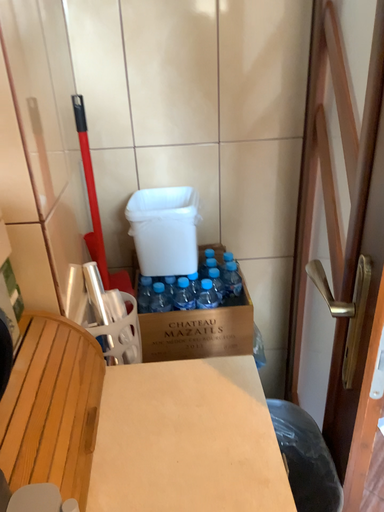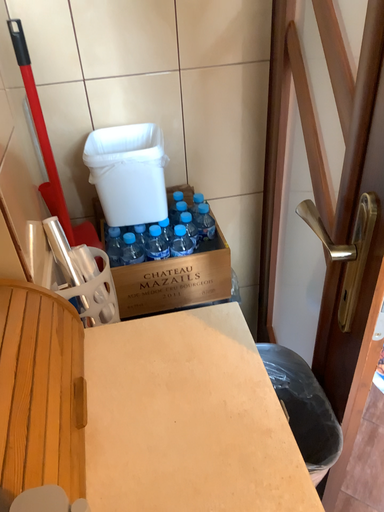
Question: Which way did the camera rotate in the video?

Choices:
 (A) rotated left
 (B) rotated right

Answer: (B)